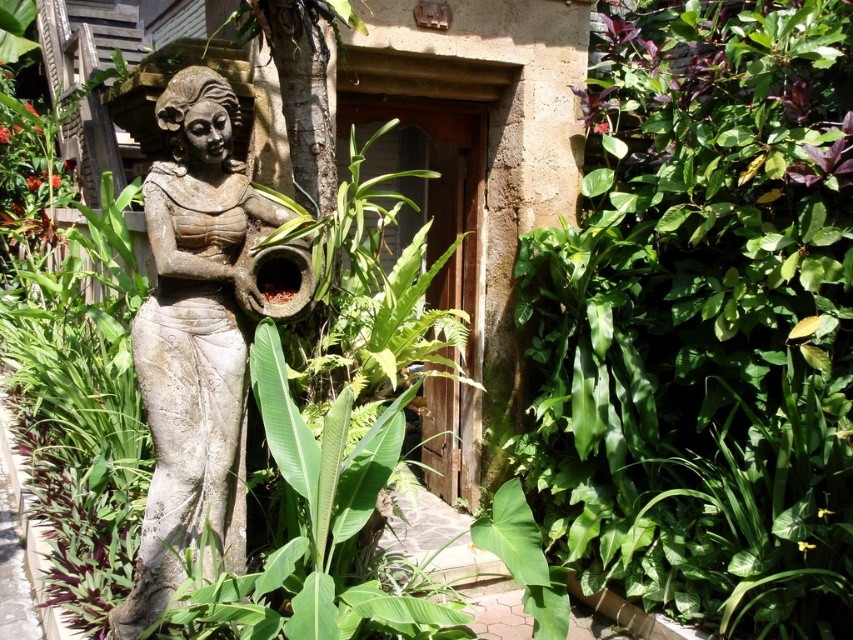
You are a gardener tasked with trimming plants in this outdoor setting. You notice the green leafy plant at center and the stone statue at center. Which object requires pruning first based on its height?

The green leafy plant at center requires pruning first because it is much taller than the stone statue at center, as stated in the description.

You are a gardener who needs to prune plants around the stone statue at center. The garden rules state you can only prune plants that are smaller than the statue. Based on the scene, should you prune the green leafy plant at center?

The green leafy plant at center is larger in size than the stone statue at center, so according to the garden rules, you should not prune it since it is bigger than the statue.